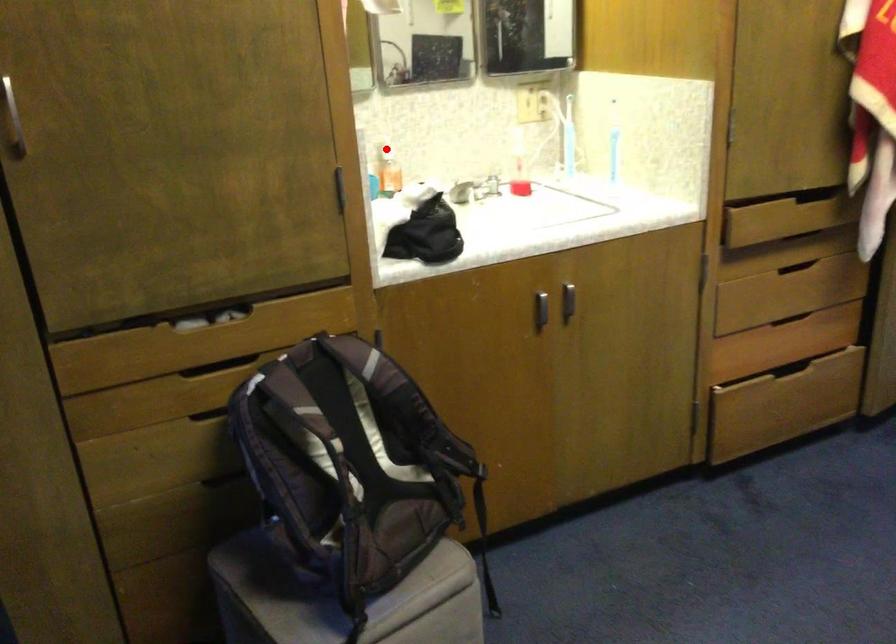
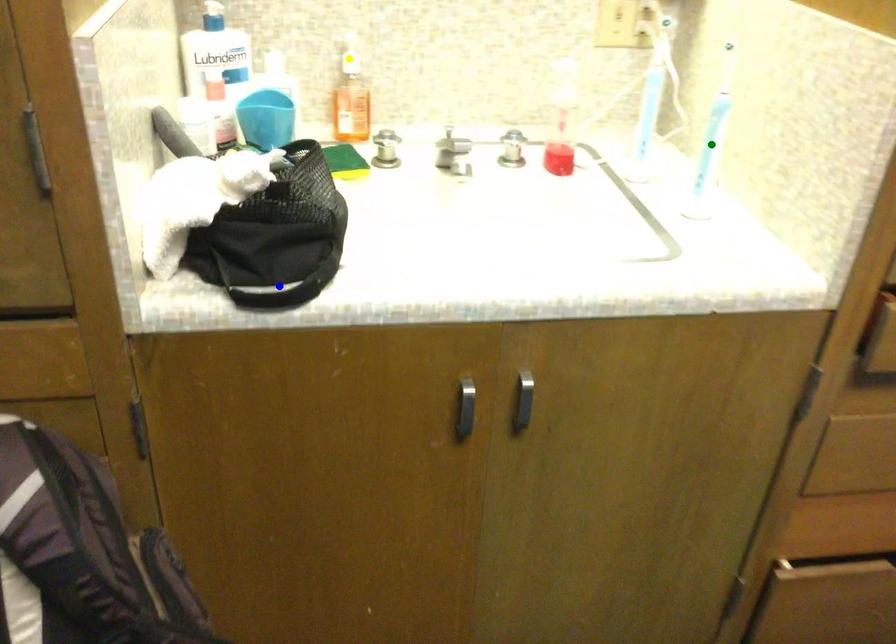
Question: I am providing you with two images of the same scene from different viewpoints. A red point is marked on the first image. You are given multiple points on the second image. Which point in image 2 is actually the same real-world point as the red point in image 1?

Choices:
 (A) green point
 (B) blue point
 (C) yellow point

Answer: (C)